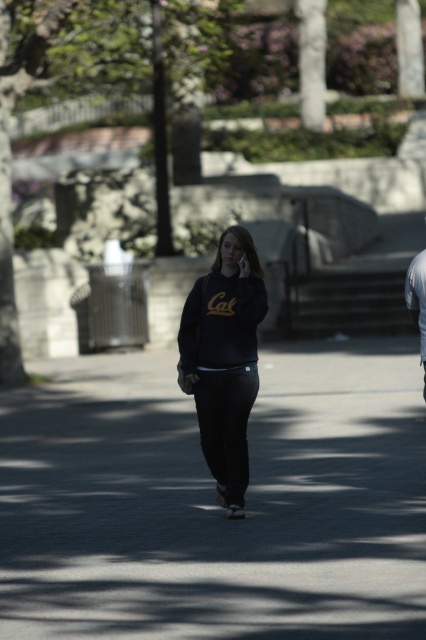
You are a photographer trying to capture a clear photo of the black matte phone at center without the dark blue fleece sweatshirt at center blocking it. What should you do?

Move the camera position to the side so that the dark blue fleece sweatshirt at center is no longer in front of the black matte phone at center. Since the dark blue fleece sweatshirt at center is currently in front of the black matte phone at center, adjusting your angle will allow you to see the phone without obstruction.

You are standing at the origin point in the scene. Which direction should you move to reach the black asphalt at center?

The black asphalt at center is located at coordinates point (215, 502), so you should move towards the direction of those coordinates to reach it.